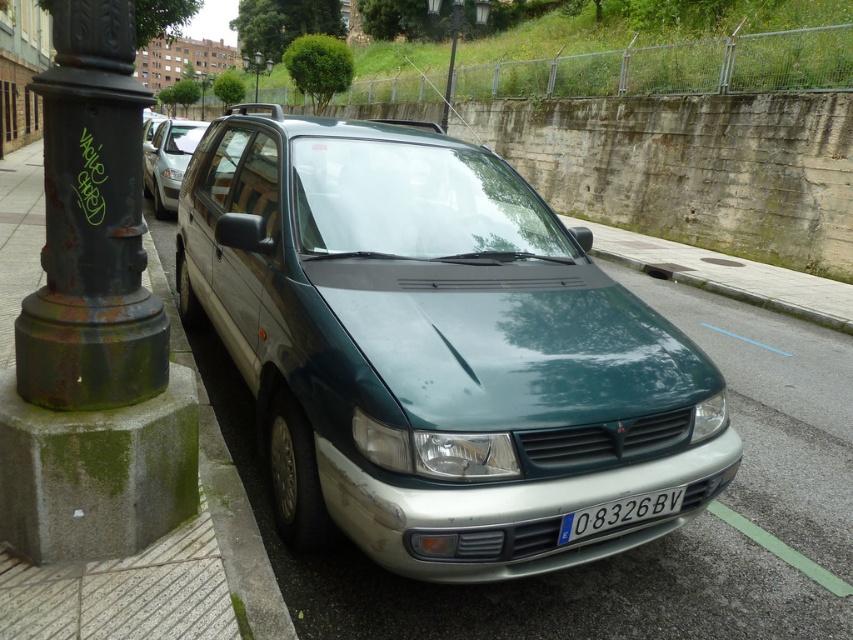
Between green matte car at center and rusty metal pole at upper left, which one is positioned lower?

Positioned lower is green matte car at center.

Between point (160, 150) and point (209, 84), which one is positioned behind?

The point (209, 84) is more distant.

Is point (196, 122) more distant than point (202, 88)?

No, it is in front of (202, 88).

Where is `green matte car at center`? Image resolution: width=853 pixels, height=640 pixels. green matte car at center is located at coordinates (167, 161).

Does white plastic license plate at center have a greater height compared to rusty metal pole at upper left?

Incorrect, white plastic license plate at center's height is not larger of rusty metal pole at upper left's.

Does white plastic license plate at center appear on the left side of rusty metal pole at upper left?

In fact, white plastic license plate at center is to the right of rusty metal pole at upper left.

Where is `white plastic license plate at center`? white plastic license plate at center is located at coordinates click(619, 513).

Where is `white plastic license plate at center`? white plastic license plate at center is located at coordinates (619, 513).

Between point (64, 35) and point (561, 538), which one is positioned in front?

Point (64, 35)

How distant is rusty metal pole at left from white plastic license plate at center?

Answer: A distance of 1.99 meters exists between rusty metal pole at left and white plastic license plate at center.

The image size is (853, 640). Find the location of `rusty metal pole at left`. rusty metal pole at left is located at coordinates (91, 225).